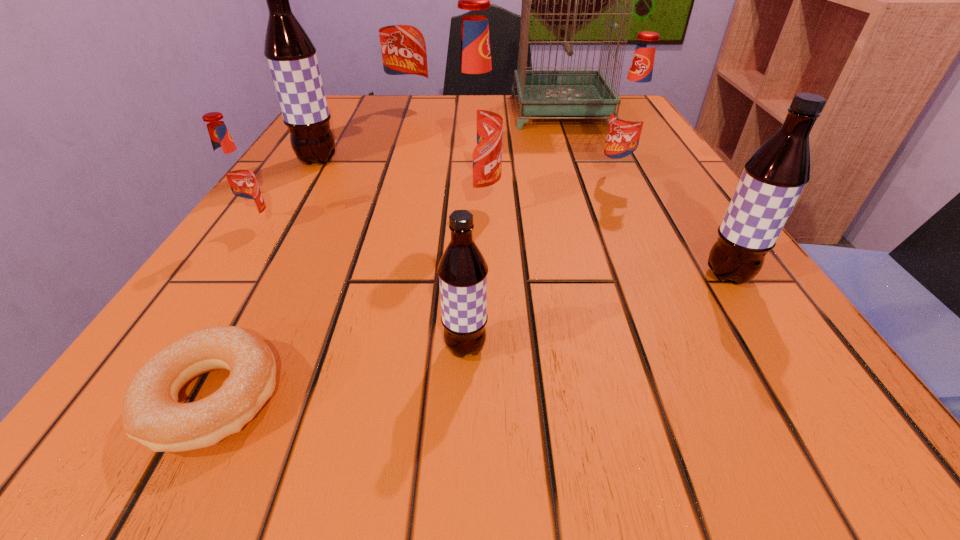
Locate an element on the screen. The width and height of the screenshot is (960, 540). birdcage is located at coordinates (539, 95).

Locate an element on the screen. Image resolution: width=960 pixels, height=540 pixels. the tallest object is located at coordinates (539, 95).

In order to click on the tallest root beer in this screenshot , I will do `click(401, 27)`.

Image resolution: width=960 pixels, height=540 pixels. I want to click on the biggest red root beer, so click(x=401, y=27).

Identify the location of the farthest brown root beer. (291, 56).

Identify the location of the leftmost brown root beer. (291, 56).

I want to click on the second biggest red root beer, so click(x=474, y=120).

Identify the location of the sixth root beer from left to right. The width and height of the screenshot is (960, 540). (631, 114).

This screenshot has height=540, width=960. What are the coordinates of `the rightmost red root beer` in the screenshot? It's located at (631, 114).

Locate an element on the screen. The width and height of the screenshot is (960, 540). the second smallest brown root beer is located at coordinates (773, 178).